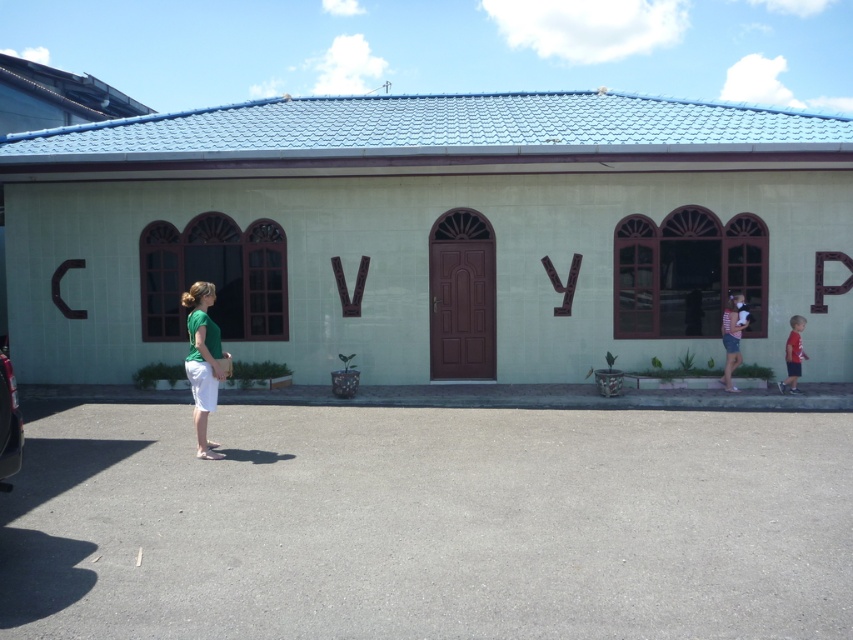
You are a photographer trying to capture a wide shot of the building and its surroundings. You notice the green matte shorts at lower left and the metallic silver car at left in your frame. Based on their positions, which object is closer to the camera?

The green matte shorts at lower left might be wider than metallic silver car at left, indicating they are closer to the camera since objects closer to the camera appear larger.

You are a photographer setting up a tripod in front of the building. You need to position it so that both the green matte shorts at lower left and the red cotton shirt at right are visible in the frame. Considering their widths, which object should you place closer to the edge of the frame to avoid cropping?

The green matte shorts at lower left are wider than the red cotton shirt at right. To avoid cropping, position the green matte shorts at lower left closer to the edge of the frame since it is wider and requires more space in the composition.